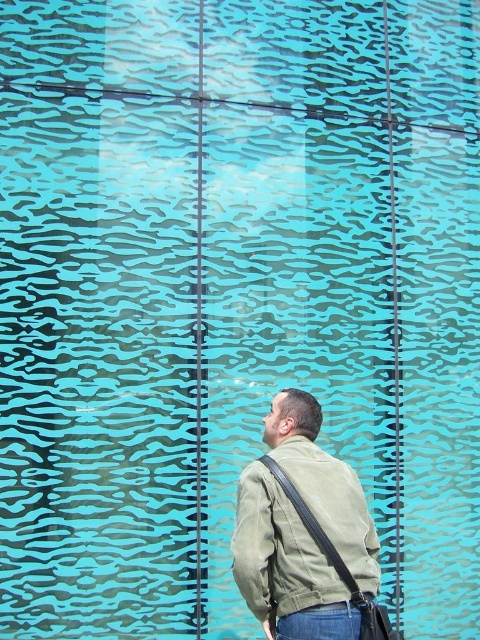
You are an observer looking at the man in front of the textured wall. Which object, the khaki fabric jacket at center or the denim at lower center, takes up more visual space in the image?

The khaki fabric jacket at center has a larger size compared to denim at lower center, so it takes up more visual space in the image.

You are standing in front of the large textured wall and notice a point marked at coordinates (285, 566). According to the scene description, what object is located at this point?

The point at coordinates (285, 566) corresponds to the khaki fabric jacket at center.